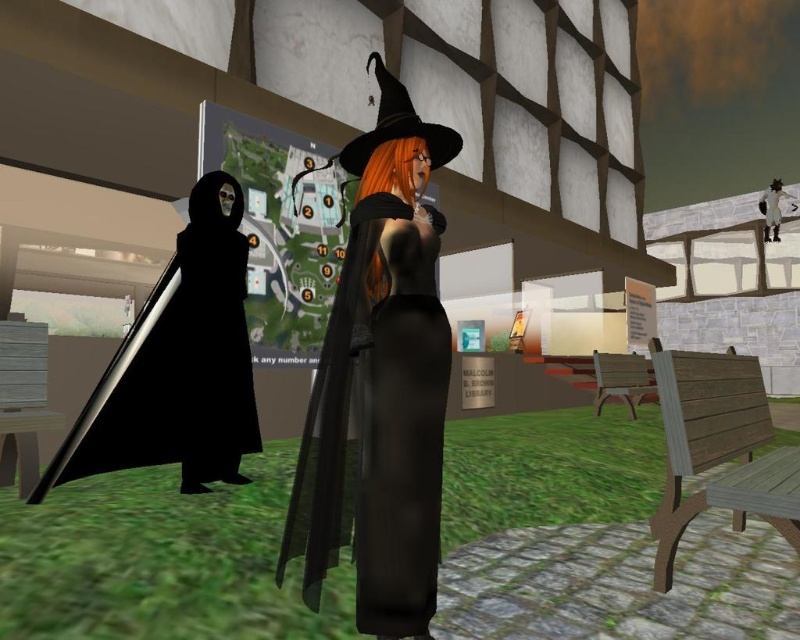
You are standing at the starting point and want to reach the matte black witch hat at upper right. There is an obstacle 10 meters away from your current position. Can you safely navigate around it to reach your destination without getting too close to the matte black witch hat at center?

The matte black witch hat at center is 13.03 meters away from the matte black witch hat at upper right. Since the obstacle is only 10 meters away from your starting position, you can go around it and still maintain a safe distance from the matte black witch hat at center while reaching the upper right hat.

You are a character in the game who needs to retrieve both the matte black witch hat at center and the matte black witch hat at upper right. Which direction should you move first to reach the one that is closer to your starting position?

The matte black witch hat at center is to the left of the matte black witch hat at upper right, so you should move left first to reach the closer one.

You are a character in this scene and need to decide which item to pick up first. The matte black witch hat at center and the black matte cloak at left are both within reach. Based on their sizes, which one do you think is easier to carry?

The matte black witch hat at center is smaller than the black matte cloak at left, so it would be easier to carry the matte black witch hat at center.